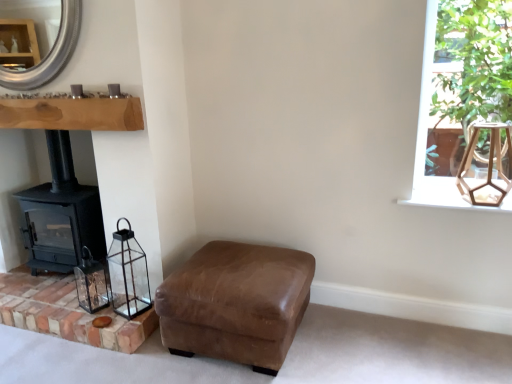
Locate an element on the screen. The image size is (512, 384). vacant area that lies to the right of clear glass lantern at lower left is located at coordinates (116, 304).